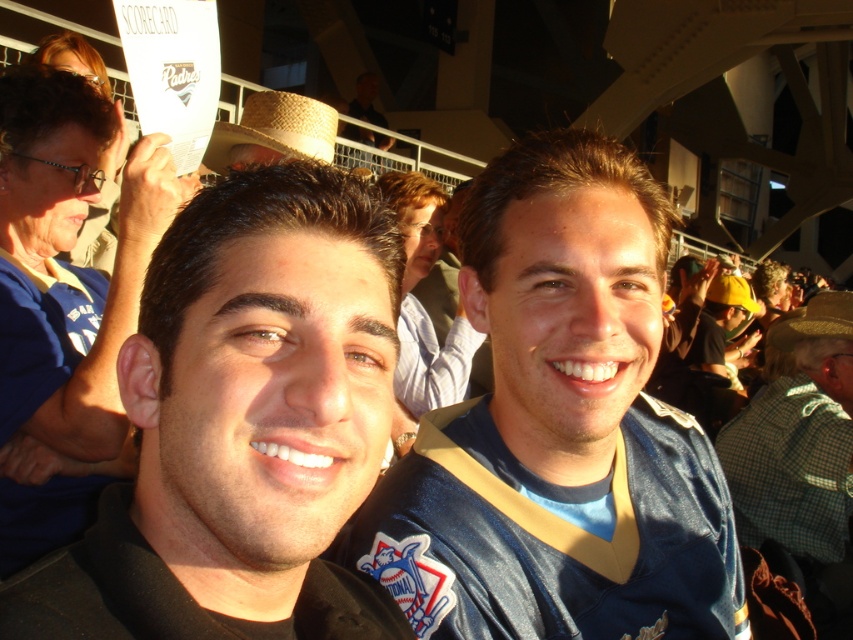
Question: Which point is farther to the camera?

Choices:
 (A) (828, 333)
 (B) (218, 449)
 (C) (256, 122)
 (D) (486, 209)

Answer: (A)

Question: Which object appears farthest from the camera in this image?

Choices:
 (A) brown straw cowboy hat at center
 (B) strawhat at upper center
 (C) black jersey at center

Answer: (A)

Question: Is black jersey at center below strawhat at upper center?

Choices:
 (A) no
 (B) yes

Answer: (B)

Question: Can you confirm if blue shiny jersey at center is positioned above black jersey at center?

Choices:
 (A) yes
 (B) no

Answer: (B)

Question: Among these points, which one is farthest from the camera?

Choices:
 (A) (329, 120)
 (B) (24, 614)
 (C) (686, 449)

Answer: (A)

Question: Does blue shiny jersey at center lie behind brown straw cowboy hat at center?

Choices:
 (A) no
 (B) yes

Answer: (A)